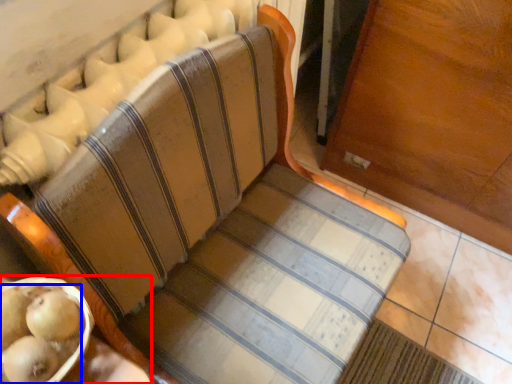
Question: Which of the following is the farthest to the observer, table (highlighted by a red box) or fruit (highlighted by a blue box)?

Choices:
 (A) table
 (B) fruit

Answer: (B)